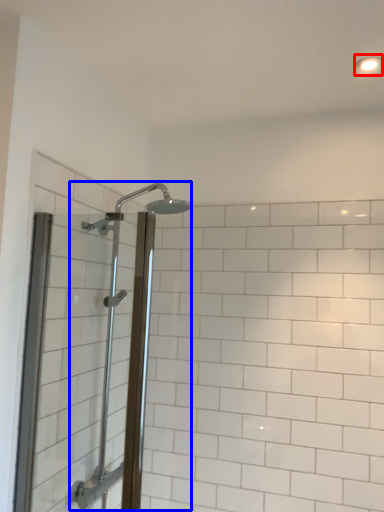
Question: Which object is further to the camera taking this photo, light fixture (highlighted by a red box) or shower (highlighted by a blue box)?

Choices:
 (A) light fixture
 (B) shower

Answer: (A)